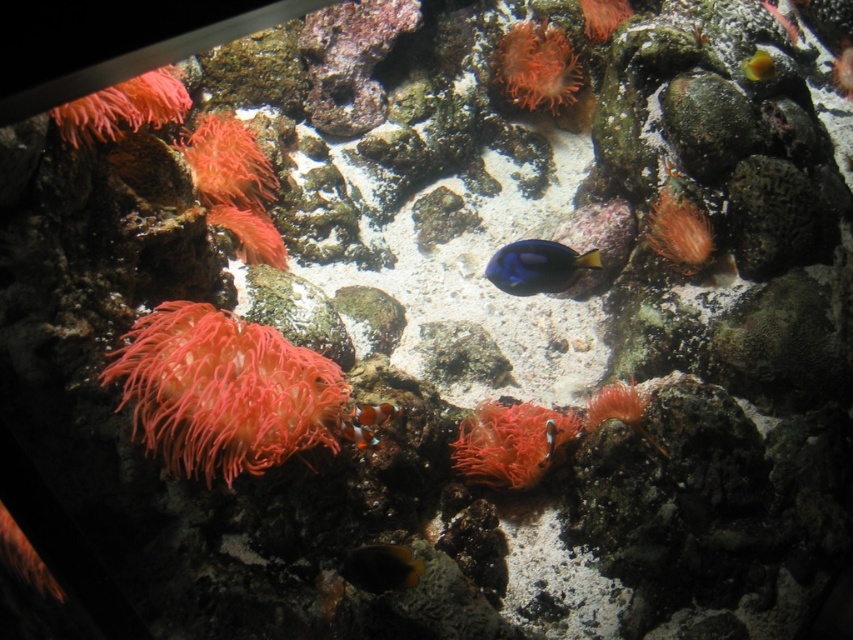
Question: Which object appears farthest from the camera in this image?

Choices:
 (A) bright red coral at center
 (B) orange matte fish at center

Answer: (A)

Question: Which point is farther to the camera?

Choices:
 (A) bright red coral at center
 (B) fluffy coral at left
 (C) soft coral at upper left

Answer: (A)

Question: Is orange matte fish at center above orange glossy clownfish at center?

Choices:
 (A) no
 (B) yes

Answer: (A)

Question: Which point is closer to the camera taking this photo?

Choices:
 (A) (387, 570)
 (B) (492, 426)
 (C) (375, 410)
 (D) (747, 74)

Answer: (A)

Question: From the image, what is the correct spatial relationship of fuzzy coral at upper center in relation to orange glossy clownfish at center?

Choices:
 (A) below
 (B) above

Answer: (B)

Question: Can you confirm if fluffy coral at left is positioned below blue glossy fish at center?

Choices:
 (A) no
 (B) yes

Answer: (B)